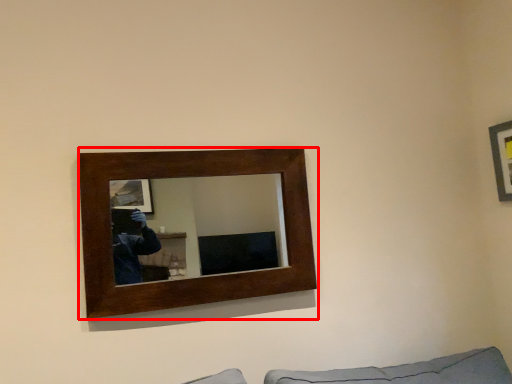
Question: Considering the relative positions of picture frame (annotated by the red box) and picture frame in the image provided, where is picture frame (annotated by the red box) located with respect to the staircase?

Choices:
 (A) right
 (B) left

Answer: (B)